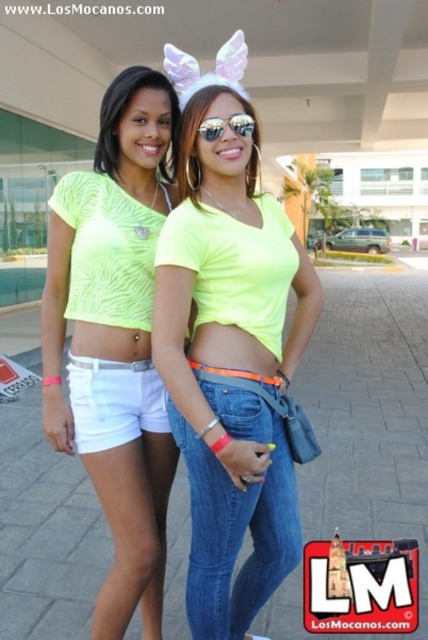
How much distance is there between neon yellow fabric shorts at lower left and white cotton shorts at lower left?

neon yellow fabric shorts at lower left and white cotton shorts at lower left are 4.60 inches apart.

Is point (148, 90) farther from camera compared to point (127, 368)?

That is True.

Is point (154, 112) less distant than point (89, 428)?

No.

Identify the location of neon yellow fabric shorts at lower left. The height and width of the screenshot is (640, 428). [115, 339].

Which is above, neon yellow fabric shorts at lower left or denim jeans at center?

neon yellow fabric shorts at lower left

Can you confirm if neon yellow fabric shorts at lower left is bigger than denim jeans at center?

Correct, neon yellow fabric shorts at lower left is larger in size than denim jeans at center.

Locate an element on the screen. This screenshot has width=428, height=640. neon yellow fabric shorts at lower left is located at coordinates (115, 339).

This screenshot has height=640, width=428. I want to click on neon yellow fabric shorts at lower left, so click(x=115, y=339).

Can you confirm if white cotton shorts at lower left is positioned below clear plastic goggles at center?

Correct, white cotton shorts at lower left is located below clear plastic goggles at center.

Describe the element at coordinates (113, 403) in the screenshot. The image size is (428, 640). I see `white cotton shorts at lower left` at that location.

Identify the location of white cotton shorts at lower left. (113, 403).

Where is `white cotton shorts at lower left`? white cotton shorts at lower left is located at coordinates (113, 403).